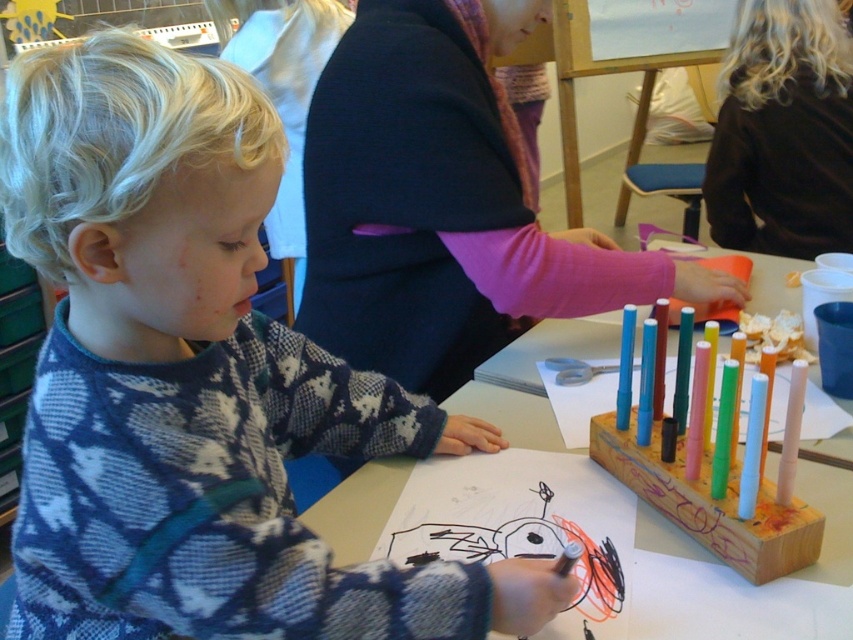
Which is in front, point (45, 484) or point (813, 140)?

Point (45, 484) is more forward.

Does knitted sweater at center have a greater height compared to black fabric at upper right?

No, knitted sweater at center is not taller than black fabric at upper right.

Which is behind, point (221, 372) or point (848, 221)?

The point (848, 221) is more distant.

In order to click on knitted sweater at center in this screenshot , I will do `click(195, 380)`.

Does dark blue fabric at center appear under black fabric at upper right?

Yes.

What do you see at coordinates (434, 208) in the screenshot? I see `dark blue fabric at center` at bounding box center [434, 208].

Locate an element on the screen. This screenshot has height=640, width=853. dark blue fabric at center is located at coordinates (434, 208).

In the scene shown: Does black fabric at upper right appear under wooden at center?

Actually, black fabric at upper right is above wooden at center.

Describe the element at coordinates (782, 132) in the screenshot. The height and width of the screenshot is (640, 853). I see `black fabric at upper right` at that location.

Image resolution: width=853 pixels, height=640 pixels. What do you see at coordinates (782, 132) in the screenshot?
I see `black fabric at upper right` at bounding box center [782, 132].

Identify the location of black fabric at upper right. The height and width of the screenshot is (640, 853). tap(782, 132).